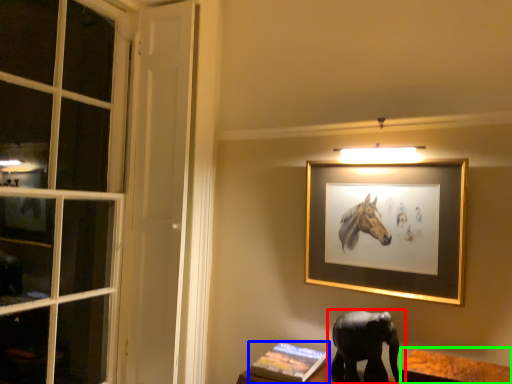
Question: Based on their relative distances, which object is nearer to elephant (highlighted by a red box)? Choose from book (highlighted by a blue box) and table (highlighted by a green box).

Choices:
 (A) book
 (B) table

Answer: (B)